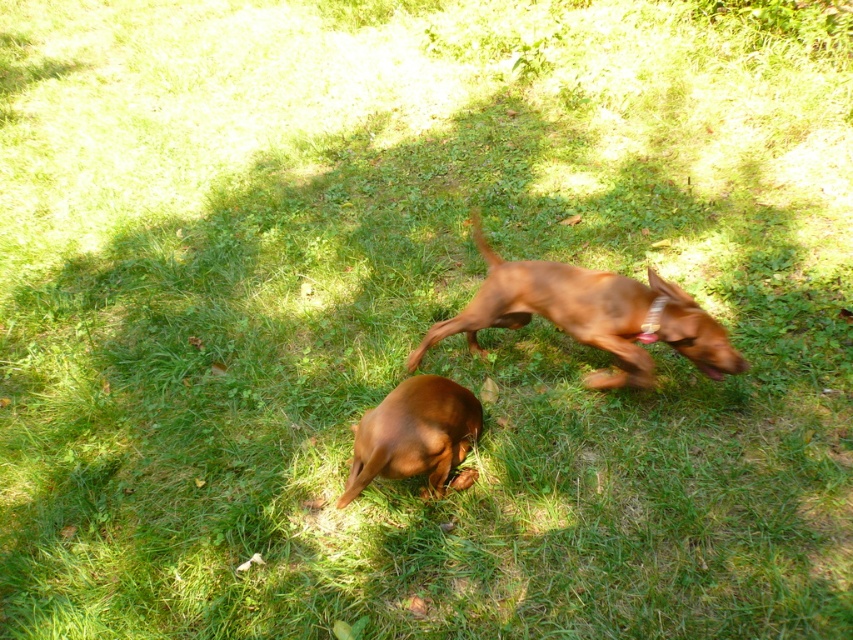
Question: Which point appears farthest from the camera in this image?

Choices:
 (A) click(x=515, y=326)
 (B) click(x=410, y=476)

Answer: (A)

Question: Does brown glossy dog at upper center appear on the right side of shiny brown dog at center?

Choices:
 (A) no
 (B) yes

Answer: (B)

Question: Where is brown glossy dog at upper center located in relation to shiny brown dog at center in the image?

Choices:
 (A) below
 (B) above

Answer: (B)

Question: Which object appears farthest from the camera in this image?

Choices:
 (A) shiny brown dog at center
 (B) brown glossy dog at upper center

Answer: (B)

Question: Which of the following is the farthest from the observer?

Choices:
 (A) (560, 324)
 (B) (352, 492)

Answer: (A)

Question: Can you confirm if brown glossy dog at upper center is positioned below shiny brown dog at center?

Choices:
 (A) no
 (B) yes

Answer: (A)